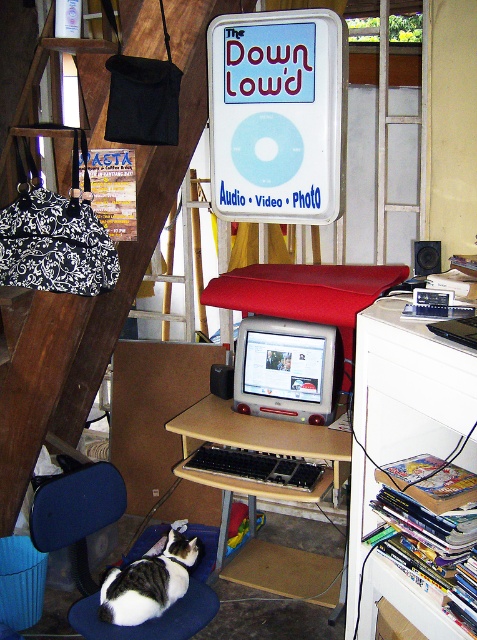
Does wooden desk at center lie in front of black plastic keyboard at center?

That is True.

In the scene shown: Can you confirm if wooden desk at center is positioned to the right of black plastic keyboard at center?

Indeed, wooden desk at center is positioned on the right side of black plastic keyboard at center.

Find the location of a particular element. This screenshot has height=640, width=477. wooden desk at center is located at coordinates (401, 412).

Which is more to the right, black plastic computer desk at center or blue fabric chair at lower left?

Positioned to the right is black plastic computer desk at center.

Who is shorter, black plastic computer desk at center or blue fabric chair at lower left?

black plastic computer desk at center

This screenshot has height=640, width=477. Describe the element at coordinates (259, 435) in the screenshot. I see `black plastic computer desk at center` at that location.

Where is `black plastic computer desk at center`? The width and height of the screenshot is (477, 640). black plastic computer desk at center is located at coordinates 259,435.

Which is above, black plastic computer desk at center or black plastic keyboard at center?

black plastic computer desk at center

Between black plastic computer desk at center and black plastic keyboard at center, which one has less height?

black plastic keyboard at center is shorter.

Who is more forward, [238,435] or [313,465]?

Point [313,465]

Locate an element on the screen. This screenshot has height=640, width=477. black plastic computer desk at center is located at coordinates (259, 435).